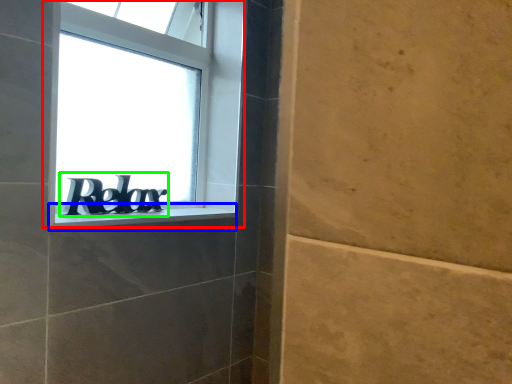
Question: Which object is positioned farthest from window (highlighted by a red box)? Select from window sill (highlighted by a blue box) and number (highlighted by a green box).

Choices:
 (A) window sill
 (B) number

Answer: (A)